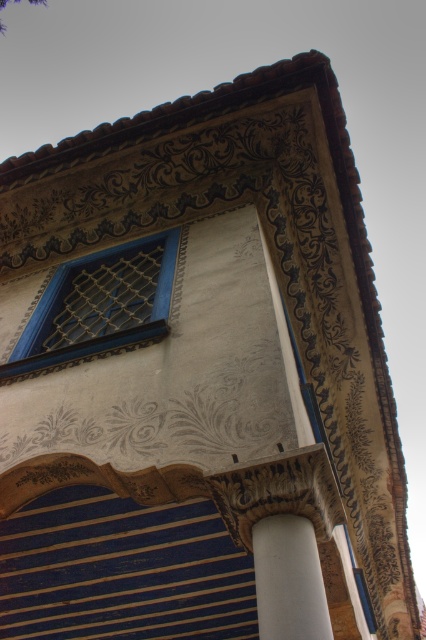
You are an architect inspecting the building facade. You notice the blue painted wood lattice at upper left and the white smooth column at lower center. Which object is located higher up on the building?

The blue painted wood lattice at upper left is positioned over the white smooth column at lower center, so it is located higher up on the building.

You are an architect examining the building exterior. You notice the blue painted wood lattice at upper left and the white smooth column at lower center. Which of these two objects has a greater size?

The blue painted wood lattice at upper left has a larger size compared to the white smooth column at lower center.